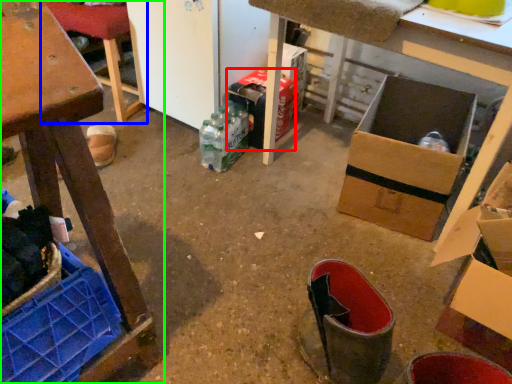
Question: Which is farther away from cardboard box (highlighted by a red box)? furniture (highlighted by a blue box) or furniture (highlighted by a green box)?

Choices:
 (A) furniture
 (B) furniture

Answer: (B)